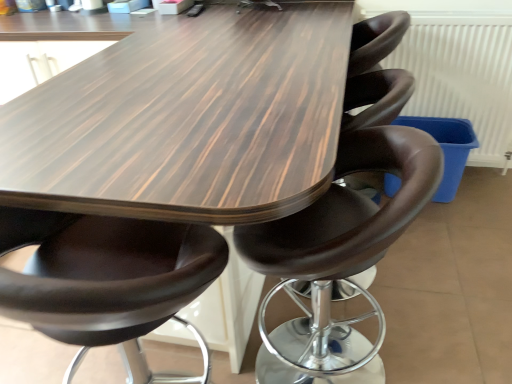
Question: From the image's perspective, is matte brown leather chair at center, the first chair viewed from the left, positioned above or below brown leather stool at center, which ranks as the 1th chair in right-to-left order?

Choices:
 (A) below
 (B) above

Answer: (A)

Question: From a real-world perspective, is matte brown leather chair at center, which is the second chair from right to left, positioned above or below brown leather stool at center, acting as the 2th chair starting from the left?

Choices:
 (A) above
 (B) below

Answer: (A)

Question: Which of these objects is positioned closest to the wooden table at center?

Choices:
 (A) brown leather stool at center, acting as the 2th chair starting from the left
 (B) white textured radiator at upper right
 (C) matte brown leather chair at center, which is the second chair from right to left

Answer: (C)

Question: Considering the real-world distances, which object is farthest from the wooden table at center?

Choices:
 (A) white textured radiator at upper right
 (B) brown leather stool at center, acting as the 2th chair starting from the left
 (C) matte brown leather chair at center, which is the second chair from right to left

Answer: (A)